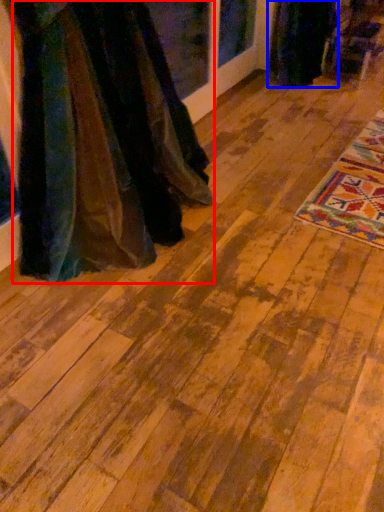
Question: Which object is further to the camera taking this photo, fancy dress (highlighted by a red box) or fancy dress (highlighted by a blue box)?

Choices:
 (A) fancy dress
 (B) fancy dress

Answer: (B)